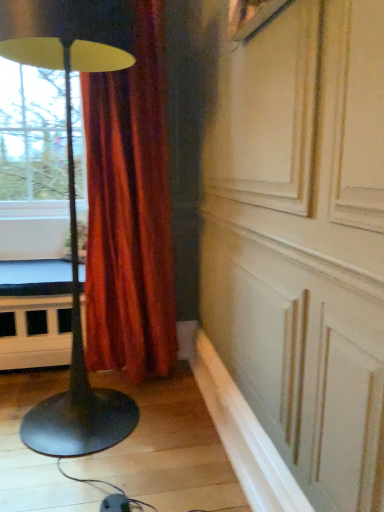
Question: Should I look upward or downward to see black matte floor lamp at left?

Choices:
 (A) down
 (B) up

Answer: (B)